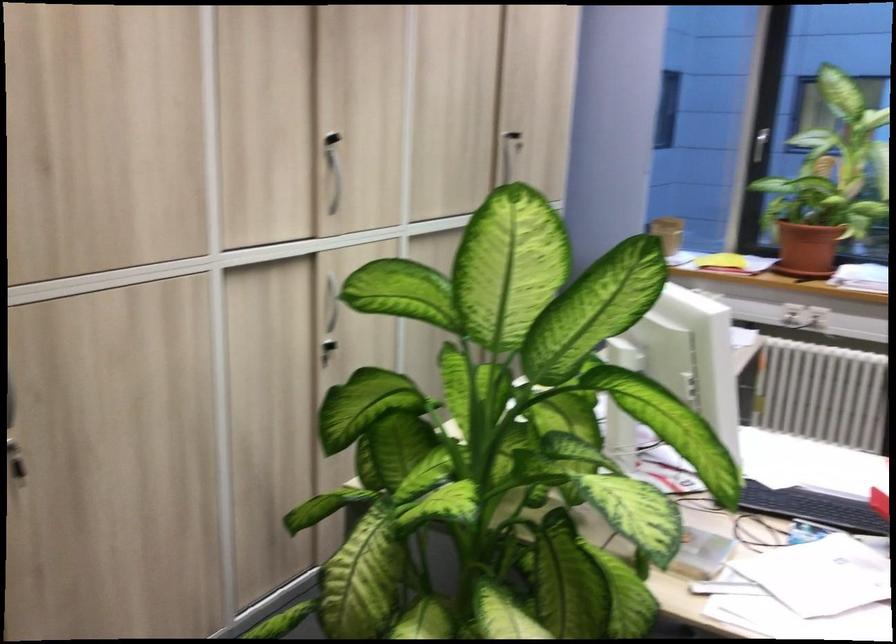
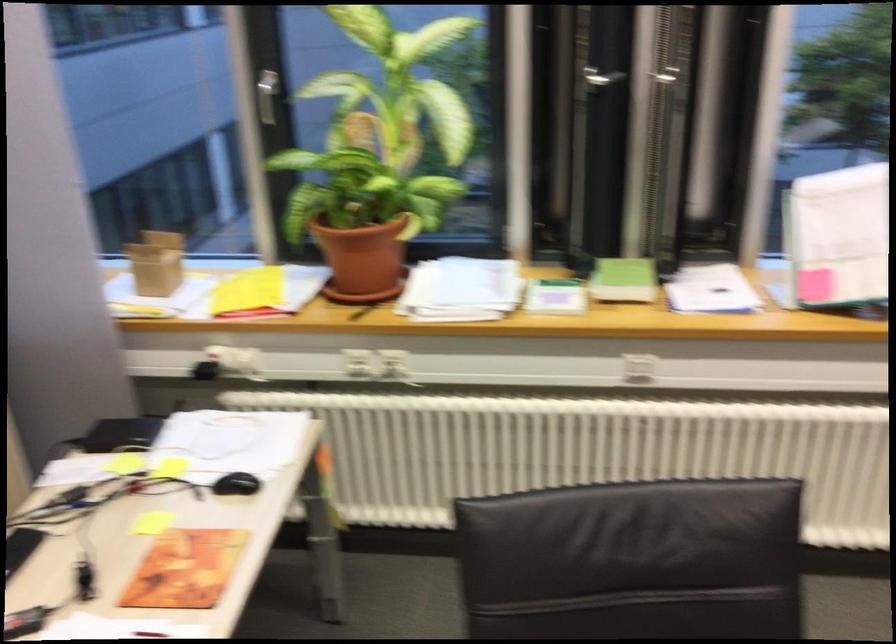
Which direction would the cameraman need to move to produce the second image?

The cameraman moved toward right, forward.